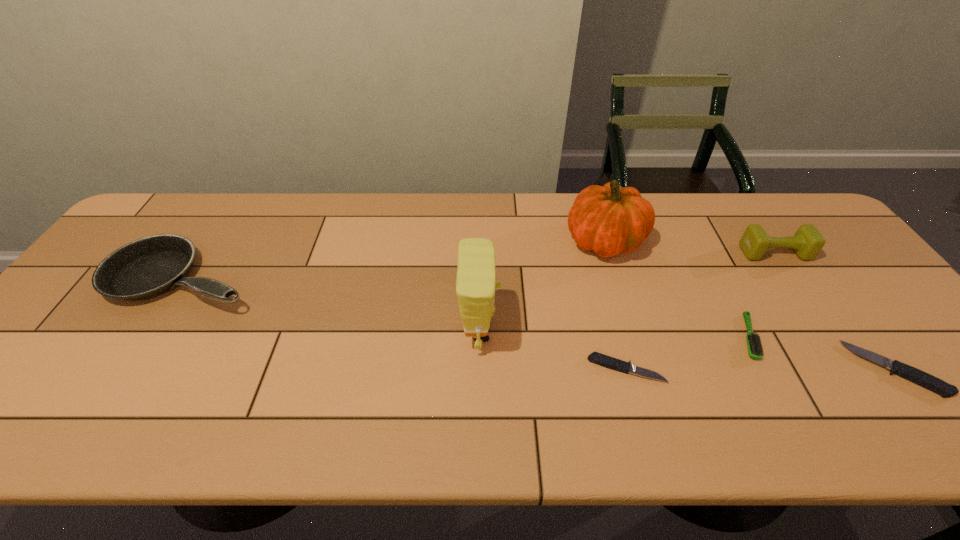
I want to click on dumbbell present at the right edge, so click(x=807, y=242).

Where is `object present at the near right corner`? This screenshot has width=960, height=540. object present at the near right corner is located at coordinates (912, 374).

In order to click on vacant space at the far edge of the desktop in this screenshot , I will do `click(484, 202)`.

Image resolution: width=960 pixels, height=540 pixels. Identify the location of vacant area at the near edge. click(x=702, y=372).

At what (x,y) coordinates should I click in order to perform the action: click on free space at the right edge of the desktop. Please return your answer as a coordinate pair (x, y). Looking at the image, I should click on (854, 321).

Locate an element on the screen. vacant space at the far right corner of the desktop is located at coordinates (781, 214).

At what (x,y) coordinates should I click in order to perform the action: click on empty location between the sponge and the pumpkin. Please return your answer as a coordinate pair (x, y). Looking at the image, I should click on (542, 286).

The height and width of the screenshot is (540, 960). What are the coordinates of `free spot between the shortest object and the dumbbell` in the screenshot? It's located at (700, 311).

Image resolution: width=960 pixels, height=540 pixels. I want to click on blank region between the frying pan and the pumpkin, so click(395, 260).

Locate an element on the screen. The height and width of the screenshot is (540, 960). empty location between the pumpkin and the sponge is located at coordinates (542, 286).